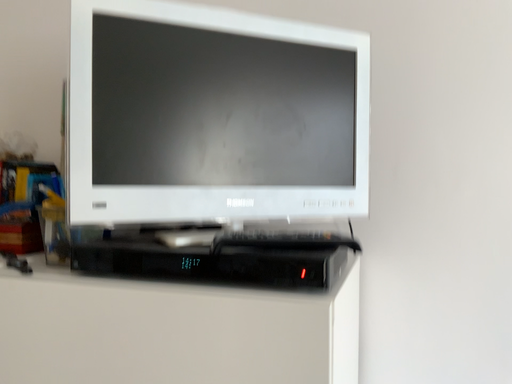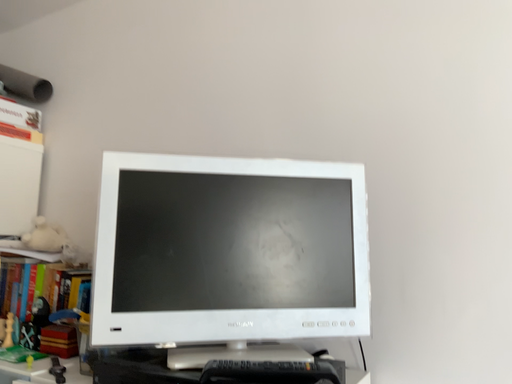
Question: How did the camera likely rotate when shooting the video?

Choices:
 (A) rotated left
 (B) rotated right

Answer: (A)